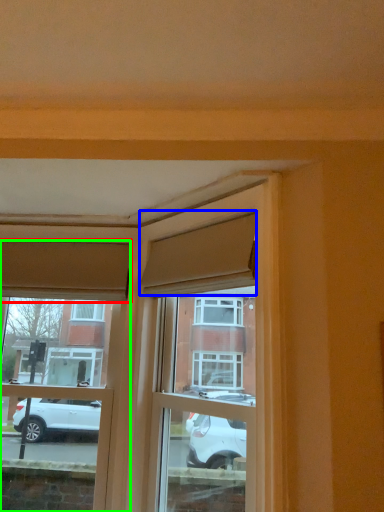
Question: Considering the real-world distances, which object is closest to curtain (highlighted by a red box)? curtain (highlighted by a blue box) or window (highlighted by a green box).

Choices:
 (A) curtain
 (B) window

Answer: (B)